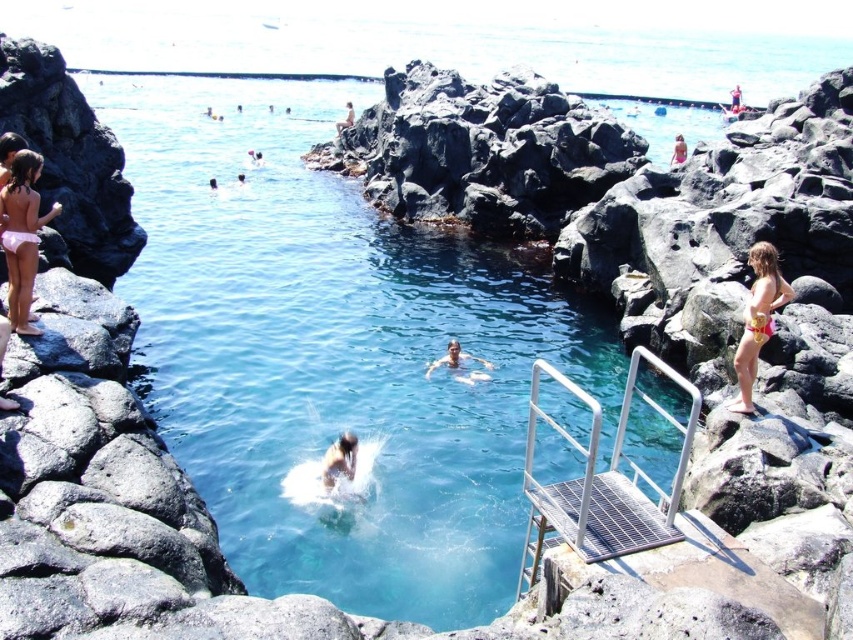
You are planning to swim in the clear blue water at center and want to ensure your pink fabric bikini at left won t get tangled in any rocks. Based on the scene description, is the bikini s location safe from the surrounding rocks?

The clear blue water at center has a larger size compared to pink fabric bikini at left, so the bikini is placed at the left side which is away from the surrounding rocks, making it a safe location.

You are a photographer trying to capture the gold metallic bikini at right and the transparent plastic pool at upper center in the same frame. Based on their positions, which object should you adjust your camera to focus on first to ensure both are in the shot?

The gold metallic bikini at right is to the left of the transparent plastic pool at upper center, so you should focus on the transparent plastic pool at upper center first to include both in the frame.

You are a swimmer who wants to reach the pink fabric bikini at left from the clear blue water at center. Given that you can swim at a speed of 1.5 meters per second, how long will it take you to reach the bikini?

The distance between the clear blue water at center and the pink fabric bikini at left is 20.07 meters. At a swimming speed of 1.5 meters per second, it would take approximately 13.38 seconds to reach the bikini.